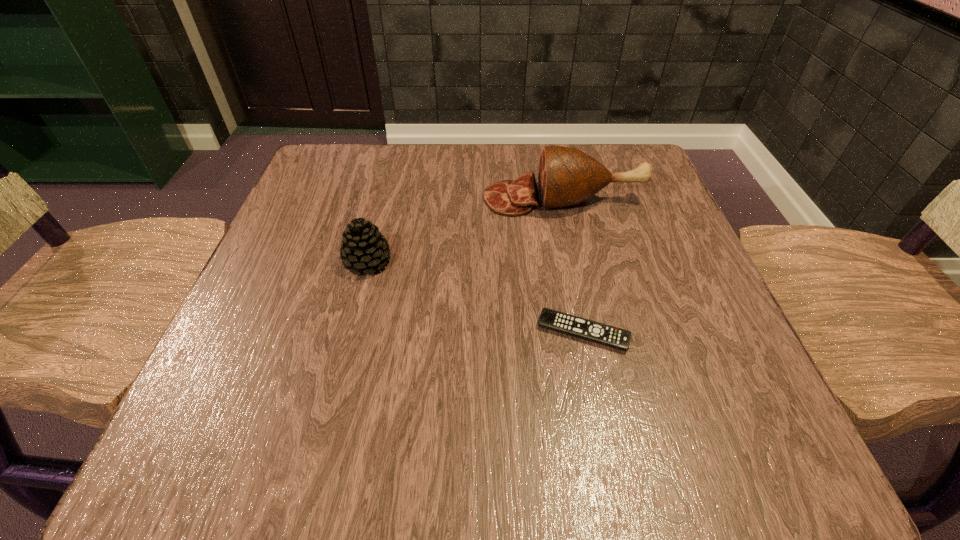
What are the coordinates of `vacant space at the near right corner` in the screenshot? It's located at (746, 418).

The image size is (960, 540). I want to click on empty space that is in between the shortest object and the pinecone, so click(475, 297).

Identify the location of free space between the remote control and the pinecone. The height and width of the screenshot is (540, 960). (475, 297).

Find the location of a particular element. vacant space in between the remote control and the farthest object is located at coordinates (573, 265).

Where is `unoccupied area between the remote control and the ham`? This screenshot has width=960, height=540. unoccupied area between the remote control and the ham is located at coordinates (573, 265).

At what (x,y) coordinates should I click in order to perform the action: click on free spot between the second tallest object and the nearest object. Please return your answer as a coordinate pair (x, y). Image resolution: width=960 pixels, height=540 pixels. Looking at the image, I should click on (475, 297).

Where is `vacant area between the remote control and the second tallest object`? The height and width of the screenshot is (540, 960). vacant area between the remote control and the second tallest object is located at coordinates (475, 297).

Locate an element on the screen. vacant space in between the second shortest object and the ham is located at coordinates (466, 230).

Find the location of a particular element. The image size is (960, 540). vacant space that's between the nearest object and the leftmost object is located at coordinates (475, 297).

Identify the location of free space between the farthest object and the remote control. (573, 265).